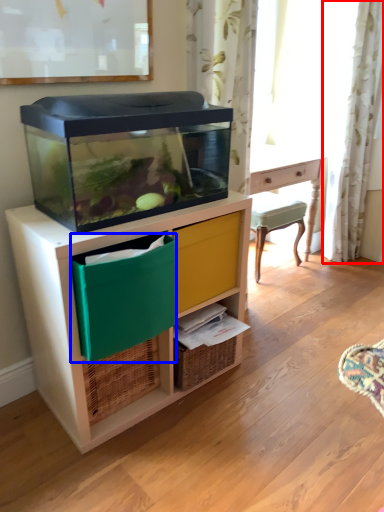
Question: Which object is closer to the camera taking this photo, curtain (highlighted by a red box) or storage box (highlighted by a blue box)?

Choices:
 (A) curtain
 (B) storage box

Answer: (B)